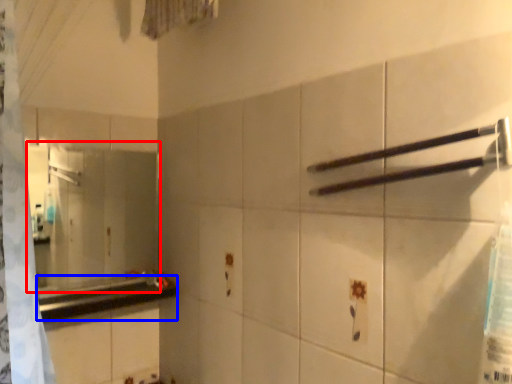
Question: Which of the following is the farthest to the observer, mirror (highlighted by a red box) or counter top (highlighted by a blue box)?

Choices:
 (A) mirror
 (B) counter top

Answer: (A)